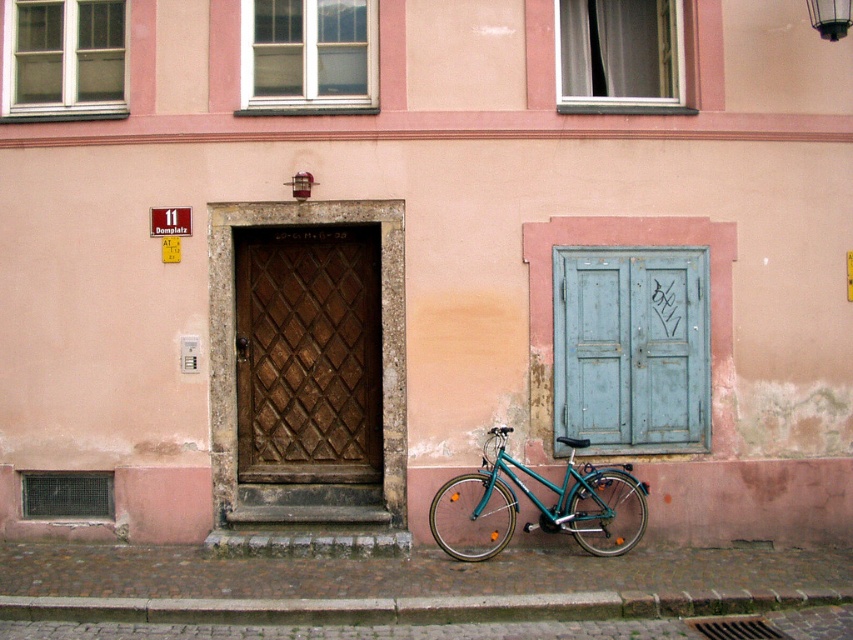
Question: Which of the following is the closest to the observer?

Choices:
 (A) (606, 604)
 (B) (624, 76)
 (C) (602, 371)

Answer: (A)

Question: Is brick at lower center wider than teal metallic bicycle at lower center?

Choices:
 (A) yes
 (B) no

Answer: (A)

Question: Is brown textured door at center to the left of gray fabric shutter at upper center from the viewer's perspective?

Choices:
 (A) no
 (B) yes

Answer: (B)

Question: Which is nearer to the gray fabric shutter at upper center?

Choices:
 (A) blue painted wood door at right
 (B) brick at lower center
 (C) brown textured door at center

Answer: (A)

Question: Among these objects, which one is farthest from the camera?

Choices:
 (A) green painted wood window at upper left
 (B) gray fabric shutter at upper center

Answer: (B)

Question: Does blue painted wood door at right appear on the left side of gray fabric shutter at upper center?

Choices:
 (A) yes
 (B) no

Answer: (B)